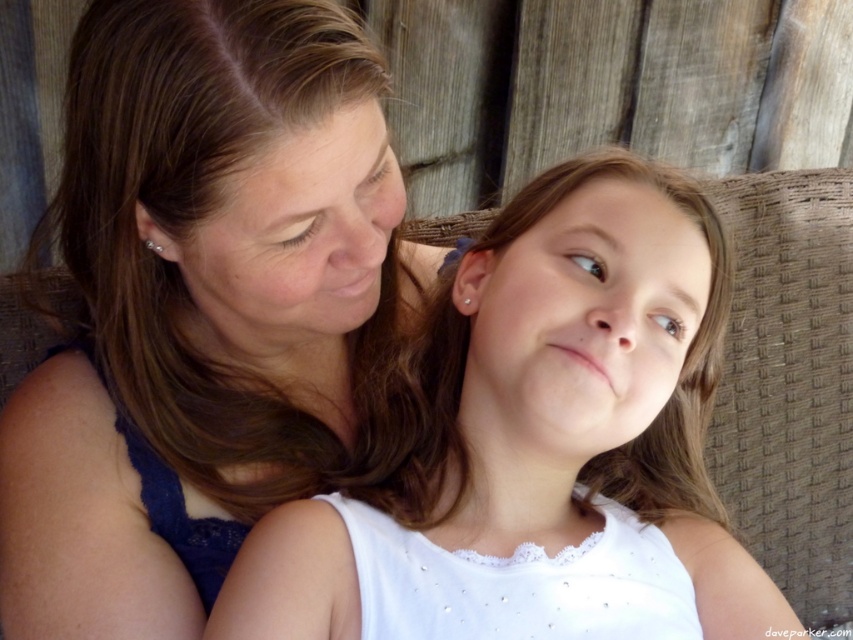
Question: Is matte blue dress at upper left above white fabric at center?

Choices:
 (A) yes
 (B) no

Answer: (A)

Question: Which of the following is the farthest from the observer?

Choices:
 (A) white fabric at center
 (B) matte blue dress at upper left

Answer: (A)

Question: Which object is closer to the camera taking this photo?

Choices:
 (A) matte blue dress at upper left
 (B) white fabric at center

Answer: (A)

Question: Is matte blue dress at upper left thinner than white fabric at center?

Choices:
 (A) no
 (B) yes

Answer: (B)

Question: Considering the relative positions of matte blue dress at upper left and white fabric at center in the image provided, where is matte blue dress at upper left located with respect to white fabric at center?

Choices:
 (A) right
 (B) left

Answer: (B)